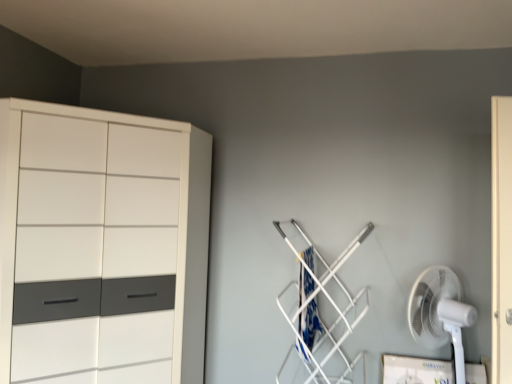
The width and height of the screenshot is (512, 384). Identify the location of blue fabric laundry at center-right. (309, 324).

Considering their positions, is blue fabric laundry at center-right located in front of or behind white plastic fan at lower right?

Clearly, blue fabric laundry at center-right is behind white plastic fan at lower right.

From a real-world perspective, is blue fabric laundry at center-right physically below white plastic fan at lower right?

No.

Looking at this image, is white plastic fan at lower right located within blue fabric laundry at center-right?

No.

Looking at this image, are white plastic fan at lower right and white glossy cupboard at left beside each other?

No, white plastic fan at lower right is not beside white glossy cupboard at left.

From a real-world perspective, which object stands above the other?

white glossy cupboard at left is physically above.

What's the angular difference between white plastic fan at lower right and white glossy cupboard at left's facing directions?

129 degrees.

Is the depth of white glossy cupboard at left less than that of white plastic fan at lower right?

Yes, it is.

Considering the sizes of white glossy cupboard at left and white plastic fan at lower right in the image, is white glossy cupboard at left taller or shorter than white plastic fan at lower right?

white glossy cupboard at left is taller than white plastic fan at lower right.

Could you tell me if white glossy cupboard at left is facing white plastic fan at lower right?

Yes, white glossy cupboard at left is aimed at white plastic fan at lower right.

The image size is (512, 384). In order to click on mechanical fan below the blue fabric laundry at center-right (from the image's perspective) in this screenshot , I will do `click(440, 313)`.

From a real-world perspective, which is physically below, white plastic fan at lower right or blue fabric laundry at center-right?

In real-world perspective, white plastic fan at lower right is lower.

From the image's perspective, is white plastic fan at lower right located above or below blue fabric laundry at center-right?

Based on their image positions, white plastic fan at lower right is located beneath blue fabric laundry at center-right.

Which object is closer to the camera, white plastic fan at lower right or blue fabric laundry at center-right?

white plastic fan at lower right is closer to the camera.

Is blue fabric laundry at center-right positioned with its back to white glossy cupboard at left?

No.

Is blue fabric laundry at center-right in contact with white glossy cupboard at left?

No, blue fabric laundry at center-right is not with white glossy cupboard at left.

Who is shorter, blue fabric laundry at center-right or white glossy cupboard at left?

blue fabric laundry at center-right is shorter.

Identify the location of laundry on the right of white glossy cupboard at left. (309, 324).

From the image's perspective, is white glossy cupboard at left under blue fabric laundry at center-right?

No, from the image's perspective, white glossy cupboard at left is not beneath blue fabric laundry at center-right.

From a real-world perspective, is white glossy cupboard at left over blue fabric laundry at center-right?

Correct, in the physical world, white glossy cupboard at left is higher than blue fabric laundry at center-right.

Consider the image. Can you confirm if white glossy cupboard at left is bigger than blue fabric laundry at center-right?

Correct, white glossy cupboard at left is larger in size than blue fabric laundry at center-right.

Identify the location of laundry lying above the white plastic fan at lower right (from the image's perspective). This screenshot has height=384, width=512. (309, 324).

The image size is (512, 384). In order to click on cupboard lying on the left of white plastic fan at lower right in this screenshot , I will do `click(101, 246)`.

When comparing their distances from white glossy cupboard at left, does white plastic fan at lower right or blue fabric laundry at center-right seem further?

Among the two, white plastic fan at lower right is located further to white glossy cupboard at left.

From the picture: When comparing their distances from blue fabric laundry at center-right, does white glossy cupboard at left or white plastic fan at lower right seem further?

Based on the image, white glossy cupboard at left appears to be further to blue fabric laundry at center-right.

From the image, which object appears to be farther from white glossy cupboard at left, blue fabric laundry at center-right or white plastic fan at lower right?

white plastic fan at lower right is further to white glossy cupboard at left.

Estimate the real-world distances between objects in this image. Which object is closer to blue fabric laundry at center-right, white plastic fan at lower right or white glossy cupboard at left?

white plastic fan at lower right is positioned closer to the anchor blue fabric laundry at center-right.

Considering their positions, is blue fabric laundry at center-right positioned closer to white plastic fan at lower right than white glossy cupboard at left?

Among the two, blue fabric laundry at center-right is located nearer to white plastic fan at lower right.

Estimate the real-world distances between objects in this image. Which object is closer to white plastic fan at lower right, white glossy cupboard at left or blue fabric laundry at center-right?

blue fabric laundry at center-right is positioned closer to the anchor white plastic fan at lower right.

At what (x,y) coordinates should I click in order to perform the action: click on laundry between white glossy cupboard at left and white plastic fan at lower right from left to right. Please return your answer as a coordinate pair (x, y). Looking at the image, I should click on [309, 324].